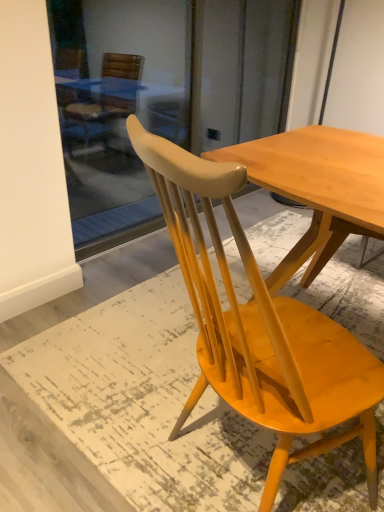
Describe the element at coordinates (260, 327) in the screenshot. This screenshot has width=384, height=512. I see `light brown wood chair at center` at that location.

Find the location of `light brown wood chair at center`. light brown wood chair at center is located at coordinates (260, 327).

Find the location of a particular element. This screenshot has width=384, height=512. light brown wood chair at center is located at coordinates (260, 327).